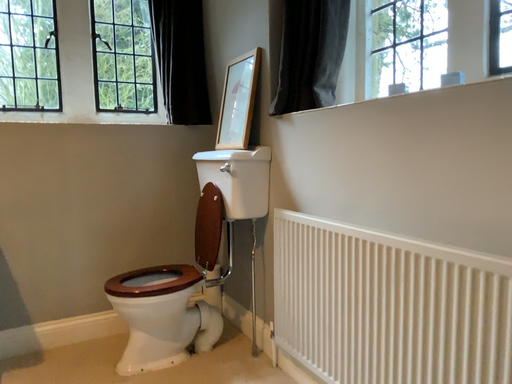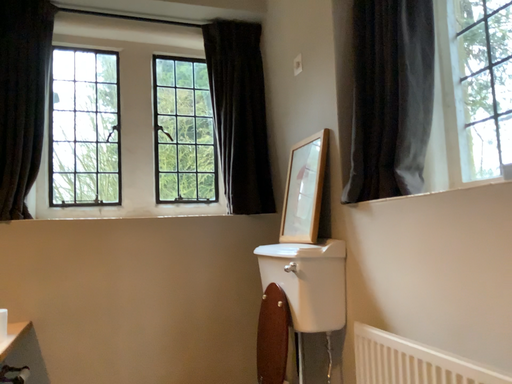
Question: Which way did the camera rotate in the video?

Choices:
 (A) rotated right
 (B) rotated left

Answer: (B)